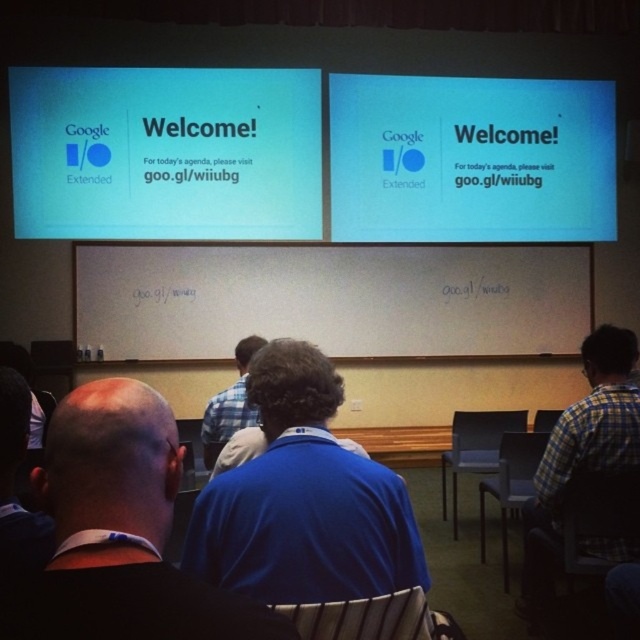
Question: Is blue fabric shirt at center bigger than wooden slats chair at center?

Choices:
 (A) yes
 (B) no

Answer: (A)

Question: Which point is closer to the camera?

Choices:
 (A) wooden slats chair at center
 (B) black plastic chair at lower right
 (C) blue shirt at center
 (D) gray plastic chair at center

Answer: (A)

Question: Among these objects, which one is nearest to the camera?

Choices:
 (A) plaid shirt at right
 (B) matte plastic chair at center
 (C) blue plaid shirt at center
 (D) white glossy projector screen at upper center

Answer: (A)

Question: Can you confirm if plaid shirt at right is positioned to the left of blue shirt at center?

Choices:
 (A) yes
 (B) no

Answer: (B)

Question: Does black fabric shirt at center have a larger size compared to black plastic chair at lower right?

Choices:
 (A) yes
 (B) no

Answer: (B)

Question: Which of these objects is positioned closest to the matte plastic chair at center?

Choices:
 (A) black plastic chair at lower right
 (B) gray plastic chair at center
 (C) white glossy projector screen at upper center
 (D) plaid shirt at right

Answer: (D)